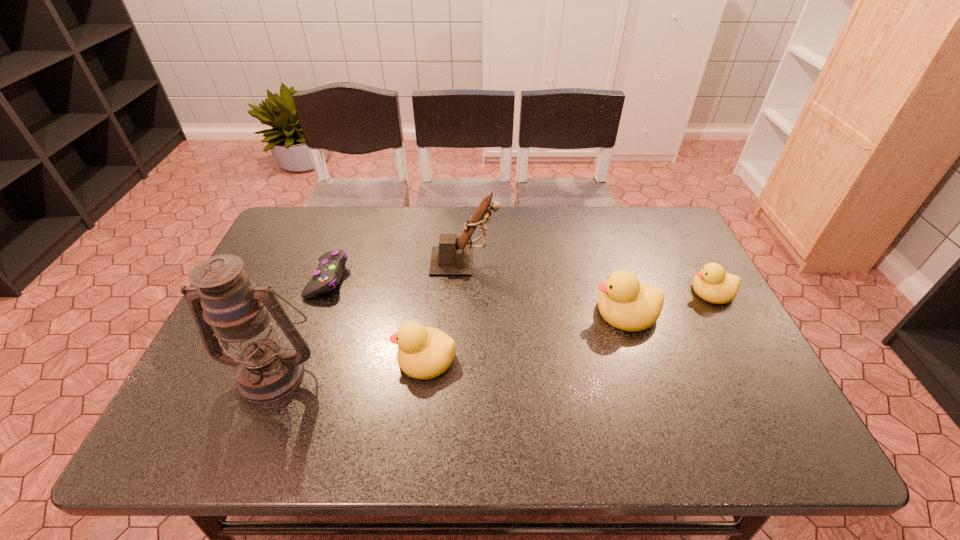
Locate an element on the screen. object that is at the far edge is located at coordinates (452, 257).

At what (x,y) coordinates should I click in order to perform the action: click on duckling present at the near edge. Please return your answer as a coordinate pair (x, y). This screenshot has width=960, height=540. Looking at the image, I should click on (423, 353).

This screenshot has height=540, width=960. What are the coordinates of `oil lamp that is at the near edge` in the screenshot? It's located at (267, 369).

Find the location of a particular element. The height and width of the screenshot is (540, 960). control positioned at the left edge is located at coordinates click(x=329, y=272).

Find the location of a particular element. oil lamp present at the left edge is located at coordinates (267, 369).

The image size is (960, 540). Identify the location of object positioned at the right edge. (712, 284).

Locate an element on the screen. The height and width of the screenshot is (540, 960). object at the near left corner is located at coordinates (267, 369).

In the image, there is a desktop. At what (x,y) coordinates should I click in order to perform the action: click on free space at the far edge. Please return your answer as a coordinate pair (x, y). The image size is (960, 540). Looking at the image, I should click on (385, 240).

In the image, there is a desktop. Where is `free space at the near edge`? The height and width of the screenshot is (540, 960). free space at the near edge is located at coordinates (642, 385).

Where is `free point at the left edge`? The height and width of the screenshot is (540, 960). free point at the left edge is located at coordinates (268, 262).